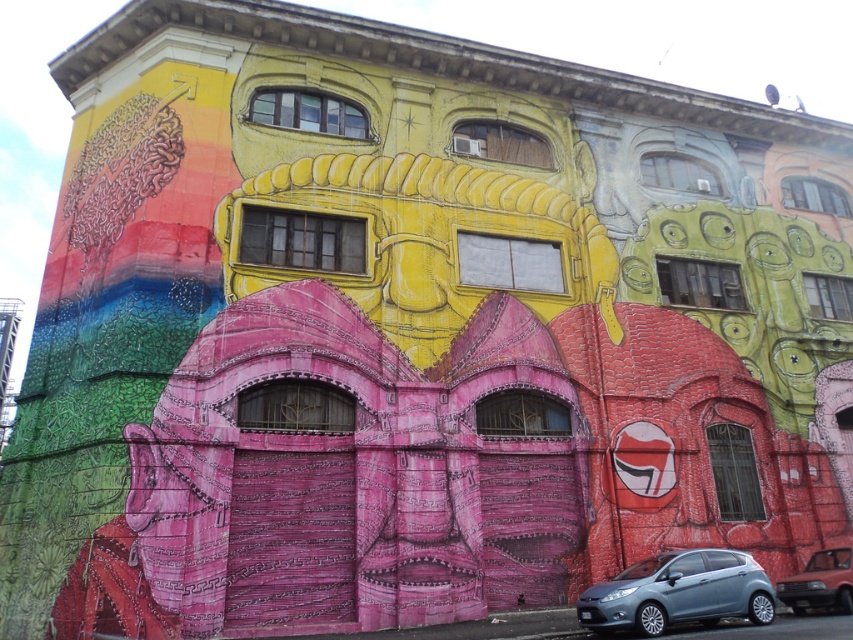
Question: Does satin blue hatchback at lower center appear under metallic red car at lower right?

Choices:
 (A) yes
 (B) no

Answer: (B)

Question: Which point is closer to the camera?

Choices:
 (A) (643, 600)
 (B) (790, 576)

Answer: (A)

Question: Does satin blue hatchback at lower center appear over metallic red car at lower right?

Choices:
 (A) no
 (B) yes

Answer: (B)

Question: Is satin blue hatchback at lower center positioned at the back of metallic red car at lower right?

Choices:
 (A) no
 (B) yes

Answer: (A)

Question: Which object is farther from the camera taking this photo?

Choices:
 (A) metallic red car at lower right
 (B) satin blue hatchback at lower center

Answer: (A)